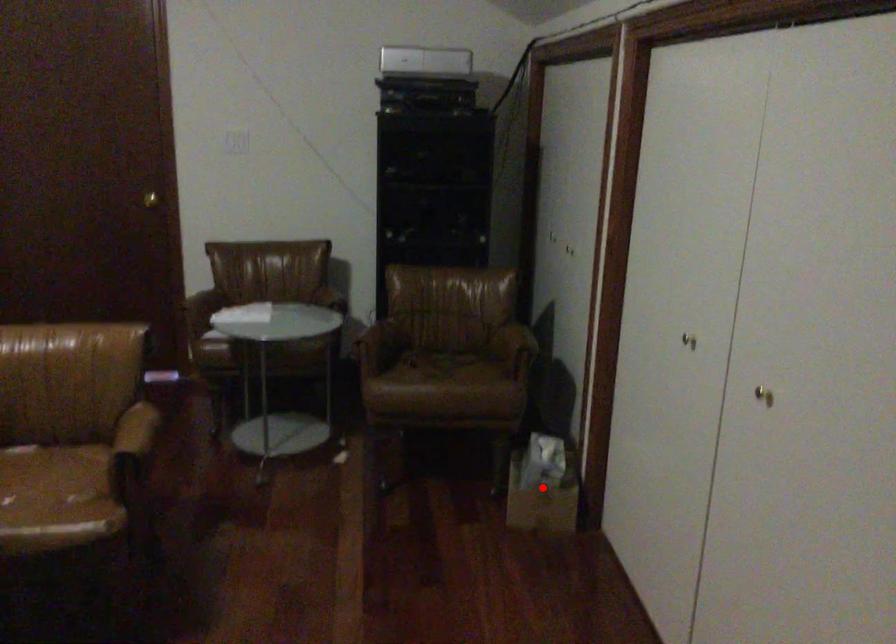
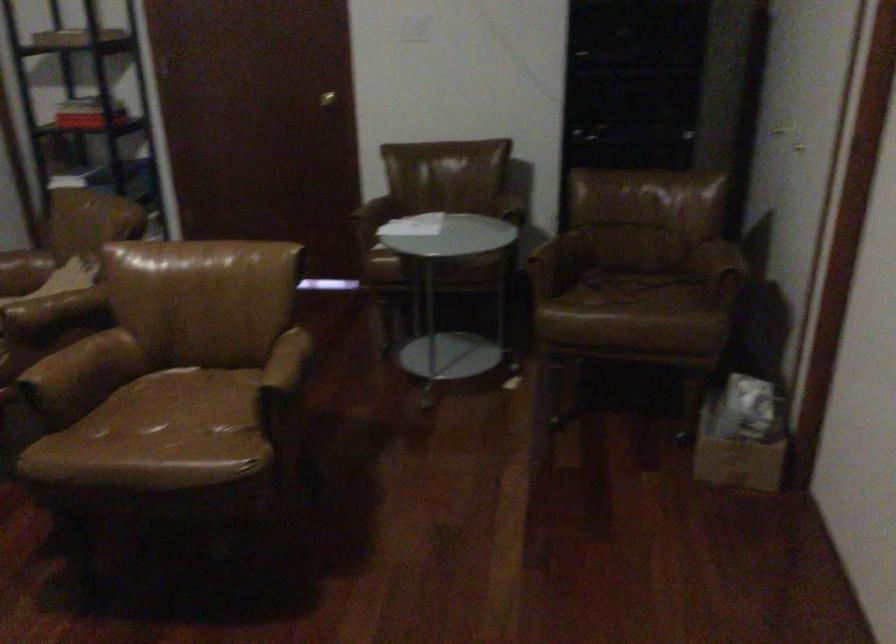
Question: I am providing you with two images of the same scene from different viewpoints. Image1 has a red point marked. In image2, the corresponding 3D location appears at what relative position? Reply with the corresponding letter.

Choices:
 (A) Closer
 (B) Farther

Answer: (A)